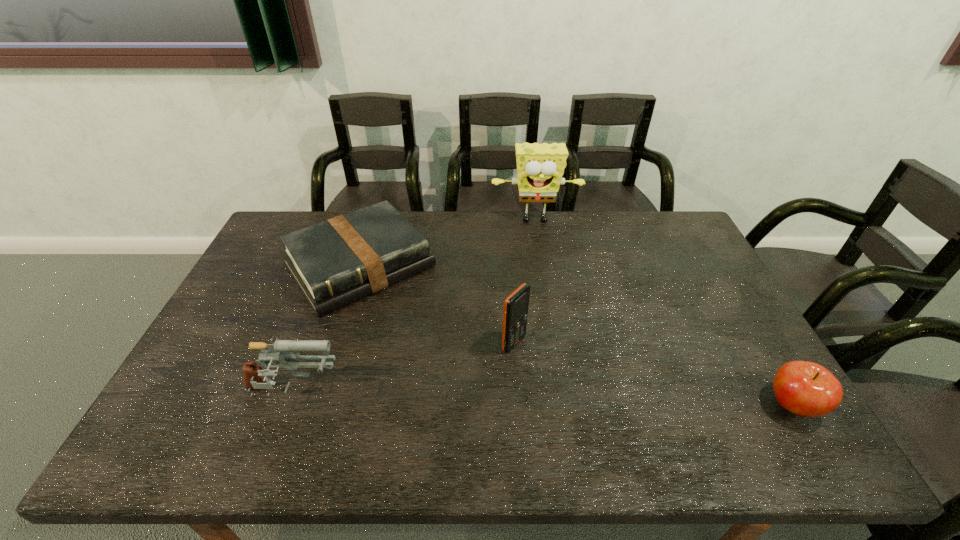
You are a GUI agent. You are given a task and a screenshot of the screen. Output one action in this format:
    pyautogui.click(x=<x>, y=<y>)
    Task: Click on the free region located on the spine side of the hardback book
    This screenshot has width=960, height=540.
    Given the screenshot: What is the action you would take?
    pyautogui.click(x=426, y=345)

Locate an element on the screen. The width and height of the screenshot is (960, 540). vacant space located on the screen of the cellular telephone is located at coordinates (559, 373).

The height and width of the screenshot is (540, 960). I want to click on free region located on the screen of the cellular telephone, so click(x=619, y=410).

Locate an element on the screen. The width and height of the screenshot is (960, 540). free location located 0.150m on the screen of the cellular telephone is located at coordinates (572, 381).

The width and height of the screenshot is (960, 540). In order to click on vacant region located on the front-facing side of the tallest object in this screenshot , I will do `click(540, 263)`.

Find the location of a particular element. The height and width of the screenshot is (540, 960). free location located 0.390m on the front-facing side of the tallest object is located at coordinates (547, 309).

Where is `blank area located on the front-facing side of the tallest object`? The width and height of the screenshot is (960, 540). blank area located on the front-facing side of the tallest object is located at coordinates (540, 253).

This screenshot has height=540, width=960. I want to click on hardback book at the far edge, so click(336, 262).

Locate an element on the screen. The height and width of the screenshot is (540, 960). sponge located at the far edge is located at coordinates (540, 167).

Where is `gun located at the near edge`? This screenshot has height=540, width=960. gun located at the near edge is located at coordinates (280, 351).